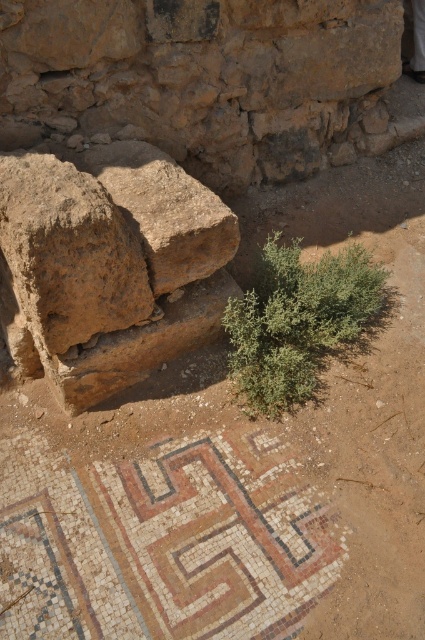
Is brown rough rock at left above brown rough rock at upper left?

Actually, brown rough rock at left is below brown rough rock at upper left.

In the scene shown: Does brown rough rock at left appear on the left side of brown rough rock at upper left?

Yes, brown rough rock at left is to the left of brown rough rock at upper left.

Which is behind, point (85, 177) or point (164, 237)?

The point (164, 237) is behind.

Find the location of `brown rough rock at left`. brown rough rock at left is located at coordinates (68, 252).